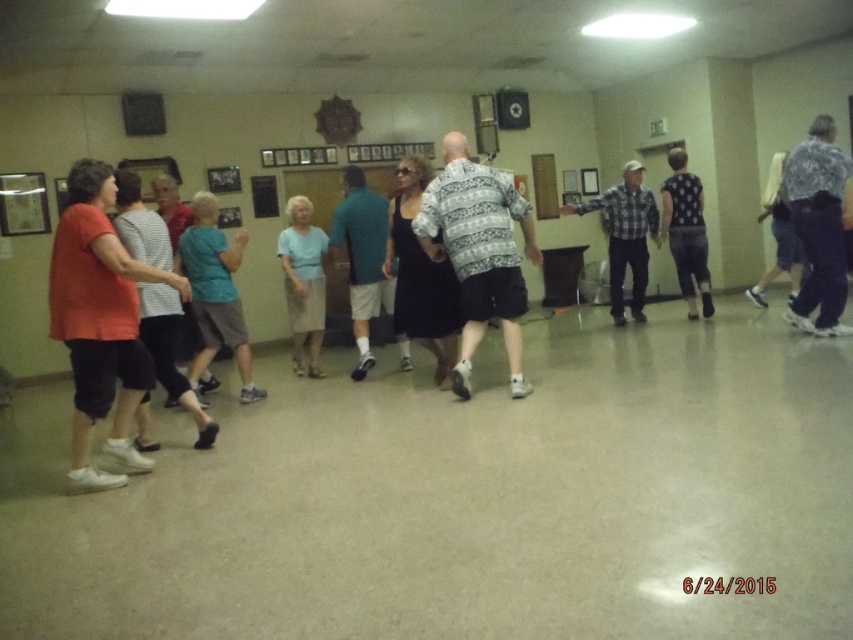
Is point (361, 186) more distant than point (675, 208)?

No, (361, 186) is closer to viewer.

Is green fabric shirt at center positioned at the back of black dotted blouse at center?

No, green fabric shirt at center is in front of black dotted blouse at center.

The image size is (853, 640). Describe the element at coordinates (363, 259) in the screenshot. I see `green fabric shirt at center` at that location.

This screenshot has width=853, height=640. Identify the location of green fabric shirt at center. (363, 259).

From the picture: Which is above, floral shirt at center or light blue fabric skirt at center?

Positioned higher is floral shirt at center.

Is floral shirt at center above light blue fabric skirt at center?

Indeed, floral shirt at center is positioned over light blue fabric skirt at center.

Is point (811, 285) positioned in front of point (318, 268)?

Yes, it is in front of point (318, 268).

What are the coordinates of `floral shirt at center` in the screenshot? It's located at (817, 227).

Who is positioned more to the right, matte red shirt at left or green fabric shirt at center?

From the viewer's perspective, green fabric shirt at center appears more on the right side.

Which is below, matte red shirt at left or green fabric shirt at center?

matte red shirt at left is below.

Which is behind, point (55, 230) or point (361, 225)?

The point (55, 230) is more distant.

At what (x,y) coordinates should I click in order to perform the action: click on matte red shirt at left. Please return your answer as a coordinate pair (x, y). The width and height of the screenshot is (853, 640). Looking at the image, I should click on (100, 323).